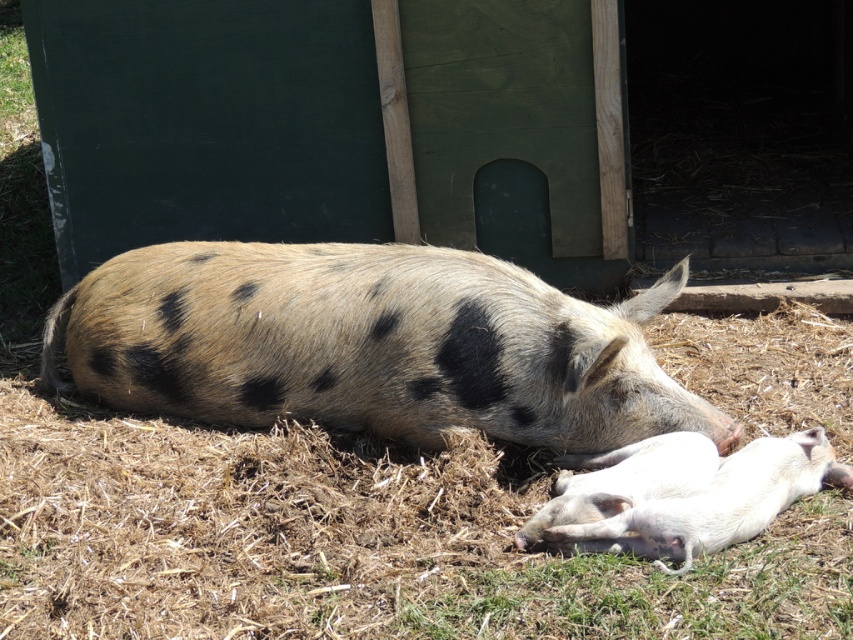
You are standing at the entrance of the pigsty and see two points marked in the image. The first point is at coordinates point [120,378] and the second point is at point [578,518]. If you want to walk from the entrance to the first point, which point should you pass through first?

Since point [120,378] is behind point [578,518], you should pass through point [578,518] first before reaching point [120,378].

You are a farmer checking on your pigs in their enclosure. You notice the spotted fur pig at center and the white smooth piglet at lower center. Which pig is positioned closer to the left side of the enclosure?

The spotted fur pig at center is positioned to the left of the white smooth piglet at lower center, so it is closer to the left side of the enclosure.

You are a farmer checking the pigs in the pigsty. You see the white smooth piglet at lower right and the white smooth piglet at lower center. Which piglet is closer to you?

The white smooth piglet at lower right is closer to you because it is in front of the white smooth piglet at lower center.